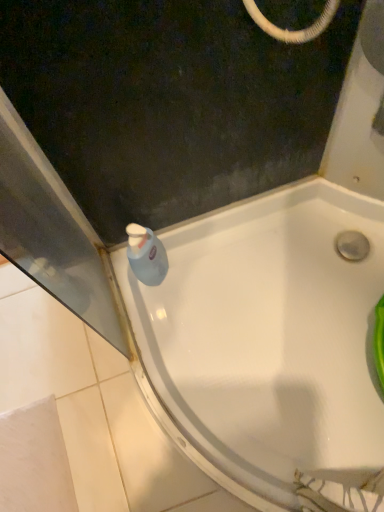
The image size is (384, 512). In order to click on white glossy bathtub at upper center in this screenshot , I will do `click(268, 347)`.

Describe the element at coordinates (268, 347) in the screenshot. I see `white glossy bathtub at upper center` at that location.

Locate an element on the screen. The height and width of the screenshot is (512, 384). white glossy bathtub at upper center is located at coordinates (268, 347).